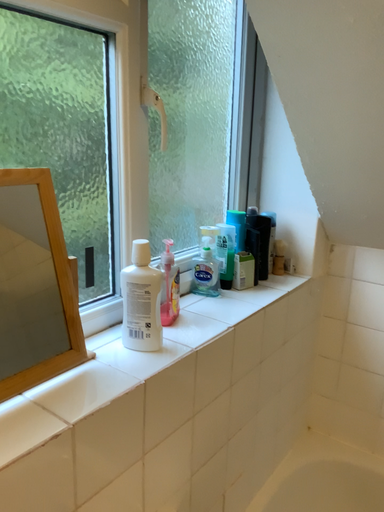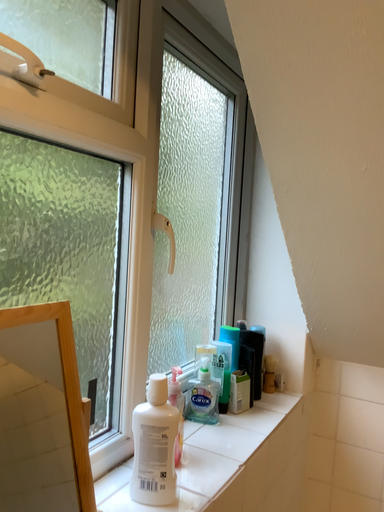
Question: Which way did the camera rotate in the video?

Choices:
 (A) rotated right
 (B) rotated left

Answer: (A)